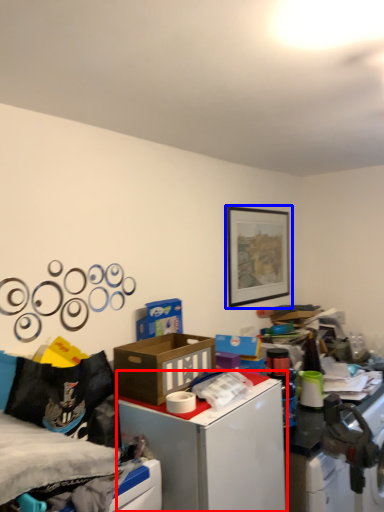
Question: Which point is further to the camera, table (highlighted by a red box) or picture frame (highlighted by a blue box)?

Choices:
 (A) table
 (B) picture frame

Answer: (B)